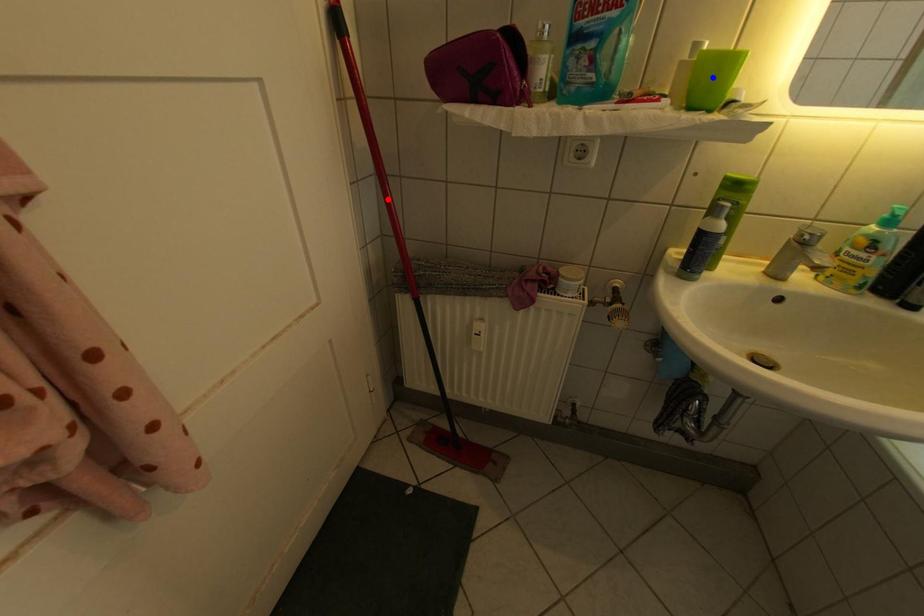
Question: Which of the two points in the image is closer to the camera?

Choices:
 (A) Blue point is closer.
 (B) Red point is closer.

Answer: (A)